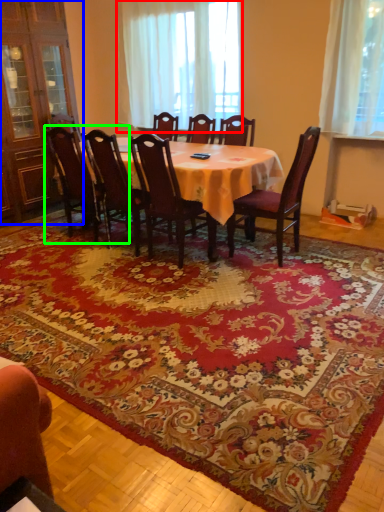
Question: Based on their relative distances, which object is farther from curtain (highlighted by a red box)? Choose from armoire (highlighted by a blue box) and chair (highlighted by a green box).

Choices:
 (A) armoire
 (B) chair

Answer: (B)